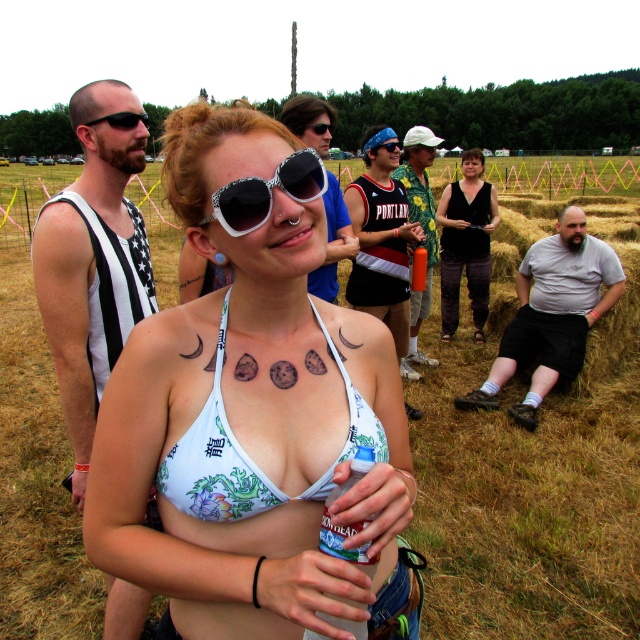
Question: Where is white cotton shirt at lower right located in relation to black jersey at center in the image?

Choices:
 (A) left
 (B) right

Answer: (A)

Question: Which point is farther to the camera?

Choices:
 (A) white fabric bikini top at center
 (B) white floral bikini top at center

Answer: (A)

Question: Can you confirm if white striped tank top at left is smaller than white plastic goggles at center?

Choices:
 (A) yes
 (B) no

Answer: (A)

Question: Is white plastic sunglasses at center positioned in front of orange matte water bottle at center?

Choices:
 (A) no
 (B) yes

Answer: (B)

Question: Among these objects, which one is nearest to the camera?

Choices:
 (A) black jersey at center
 (B) white floral bikini top at center

Answer: (B)

Question: Which of the following is the farthest from the observer?

Choices:
 (A) (392, 144)
 (B) (141, 118)
 (C) (312, 156)
 (D) (76, 246)

Answer: (A)